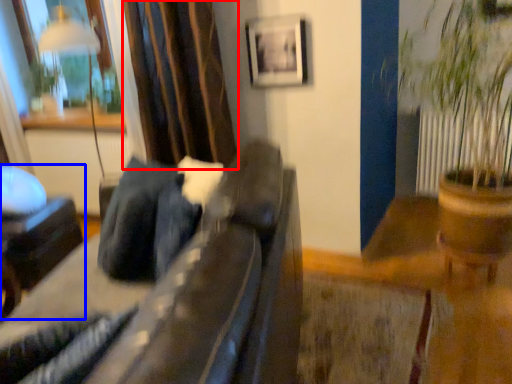
Question: Which of the following is the farthest to the observer, curtain (highlighted by a red box) or furniture (highlighted by a blue box)?

Choices:
 (A) curtain
 (B) furniture

Answer: (B)